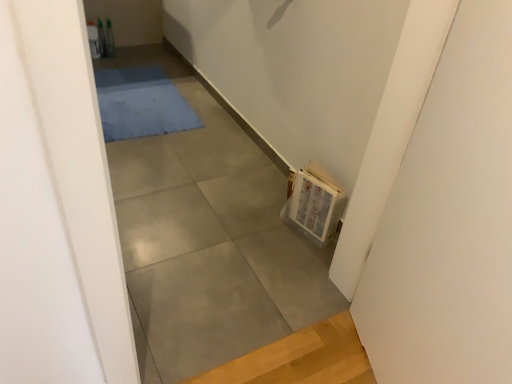
Question: Is gray concrete at center not within blue soft rug at upper center?

Choices:
 (A) yes
 (B) no

Answer: (A)

Question: Is gray concrete at center positioned in front of blue soft rug at upper center?

Choices:
 (A) no
 (B) yes

Answer: (B)

Question: Does gray concrete at center have a greater width compared to blue soft rug at upper center?

Choices:
 (A) no
 (B) yes

Answer: (B)

Question: Could you tell me if gray concrete at center is facing blue soft rug at upper center?

Choices:
 (A) yes
 (B) no

Answer: (B)

Question: Are gray concrete at center and blue soft rug at upper center beside each other?

Choices:
 (A) no
 (B) yes

Answer: (A)

Question: From a real-world perspective, relative to gray concrete at center, is blue soft rug at upper center vertically above or below?

Choices:
 (A) above
 (B) below

Answer: (A)

Question: Is blue soft rug at upper center wider or thinner than gray concrete at center?

Choices:
 (A) wide
 (B) thin

Answer: (B)

Question: Is blue soft rug at upper center taller or shorter than gray concrete at center?

Choices:
 (A) short
 (B) tall

Answer: (A)

Question: Based on their sizes in the image, would you say blue soft rug at upper center is bigger or smaller than gray concrete at center?

Choices:
 (A) small
 (B) big

Answer: (A)

Question: Is point (309, 170) closer or farther from the camera than point (118, 120)?

Choices:
 (A) farther
 (B) closer

Answer: (B)

Question: In the image, is wooden frame at right on the left side or the right side of blue soft rug at upper center?

Choices:
 (A) right
 (B) left

Answer: (A)

Question: From the image's perspective, is wooden frame at right positioned above or below blue soft rug at upper center?

Choices:
 (A) above
 (B) below

Answer: (B)

Question: Do you think wooden frame at right is within blue soft rug at upper center, or outside of it?

Choices:
 (A) inside
 (B) outside

Answer: (B)

Question: From a real-world perspective, relative to wooden frame at right, is blue soft rug at upper center vertically above or below?

Choices:
 (A) below
 (B) above

Answer: (A)

Question: In terms of height, does blue soft rug at upper center look taller or shorter compared to wooden frame at right?

Choices:
 (A) short
 (B) tall

Answer: (A)